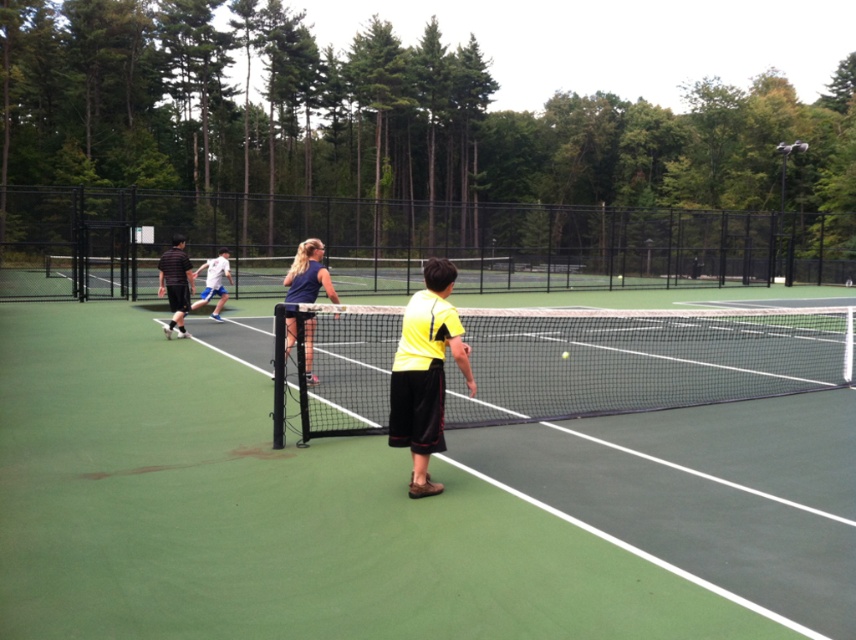
Question: Can you confirm if green synthetic surface at center is bigger than dark blue jersey at center?

Choices:
 (A) yes
 (B) no

Answer: (A)

Question: Does yellow matte shirt at center appear over white cotton shirt at center?

Choices:
 (A) no
 (B) yes

Answer: (A)

Question: Among these points, which one is nearest to the camera?

Choices:
 (A) (308, 349)
 (B) (423, 445)
 (C) (177, 323)
 (D) (642, 328)

Answer: (B)

Question: Which object is the farthest from the white cotton shirt at center?

Choices:
 (A) black mesh tennis net at center
 (B) yellow matte shirt at center

Answer: (B)

Question: Which object is positioned farthest from the striped jersey shorts at left?

Choices:
 (A) white cotton shirt at center
 (B) dark blue jersey at center
 (C) green synthetic surface at center

Answer: (C)

Question: Does yellow matte shirt at center have a greater width compared to dark blue jersey at center?

Choices:
 (A) no
 (B) yes

Answer: (B)